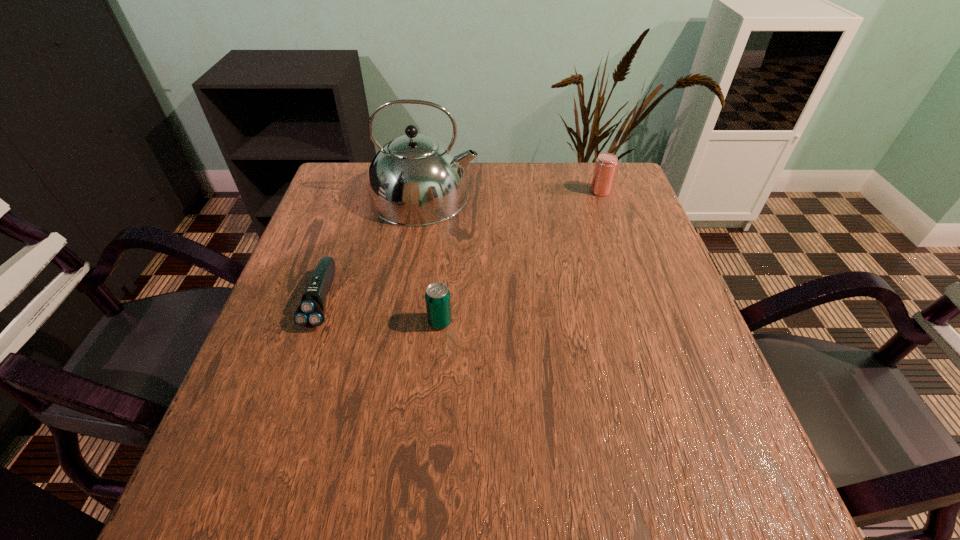
Locate an element on the screen. The width and height of the screenshot is (960, 540). the tallest object is located at coordinates (415, 180).

Where is `the farther beer can`? This screenshot has width=960, height=540. the farther beer can is located at coordinates (606, 163).

The height and width of the screenshot is (540, 960). Find the location of `the rightmost object`. the rightmost object is located at coordinates (606, 163).

Where is `the left beer can`? Image resolution: width=960 pixels, height=540 pixels. the left beer can is located at coordinates click(x=437, y=296).

Where is `the leftmost object`? the leftmost object is located at coordinates (310, 313).

Identify the location of the shortest object. (310, 313).

Locate an element on the screen. The height and width of the screenshot is (540, 960). vacant space located from the spout of the kettle is located at coordinates (508, 196).

This screenshot has width=960, height=540. Find the location of `vacant region located 0.060m on the front of the rightmost object`. vacant region located 0.060m on the front of the rightmost object is located at coordinates (607, 210).

Find the location of a particular element. The width and height of the screenshot is (960, 540). free location located on the left of the nearer beer can is located at coordinates (271, 322).

Where is `free location located on the head of the leftmost object`? Image resolution: width=960 pixels, height=540 pixels. free location located on the head of the leftmost object is located at coordinates (255, 498).